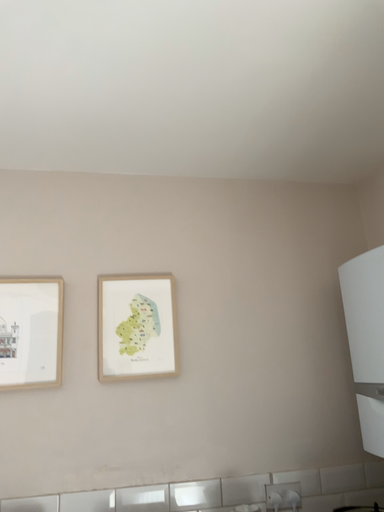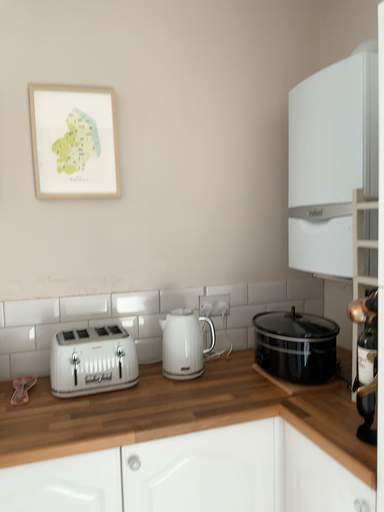
Question: Which way did the camera rotate in the video?

Choices:
 (A) rotated upward
 (B) rotated downward

Answer: (B)